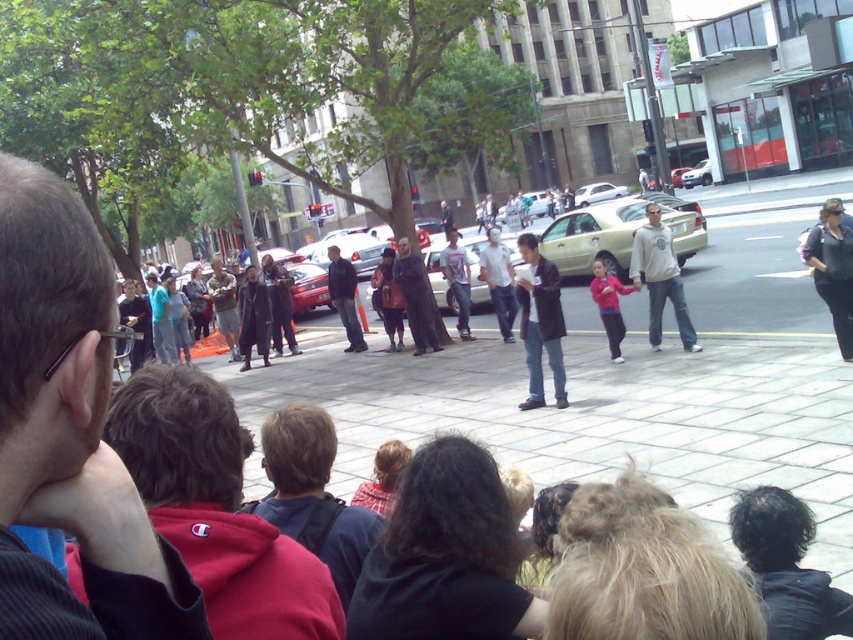
Question: Among these points, which one is nearest to the camera?

Choices:
 (A) (608, 276)
 (B) (844, 225)

Answer: (B)

Question: Which of the following is the closest to the observer?

Choices:
 (A) black leather jacket at right
 (B) light gray jeans at center
 (C) black matte cape at center
 (D) pink fleece jacket at center

Answer: (A)

Question: Is dark brown hair at center positioned at the back of metallic silver sedan at center?

Choices:
 (A) yes
 (B) no

Answer: (B)

Question: Does black matte cape at center have a lesser width compared to metallic silver sedan at center?

Choices:
 (A) yes
 (B) no

Answer: (A)

Question: Which point is closer to the camera?

Choices:
 (A) pos(454,260)
 (B) pos(488,269)

Answer: (B)

Question: Where is black leather jacket at right located in relation to light blue jeans at center in the image?

Choices:
 (A) above
 (B) below

Answer: (B)